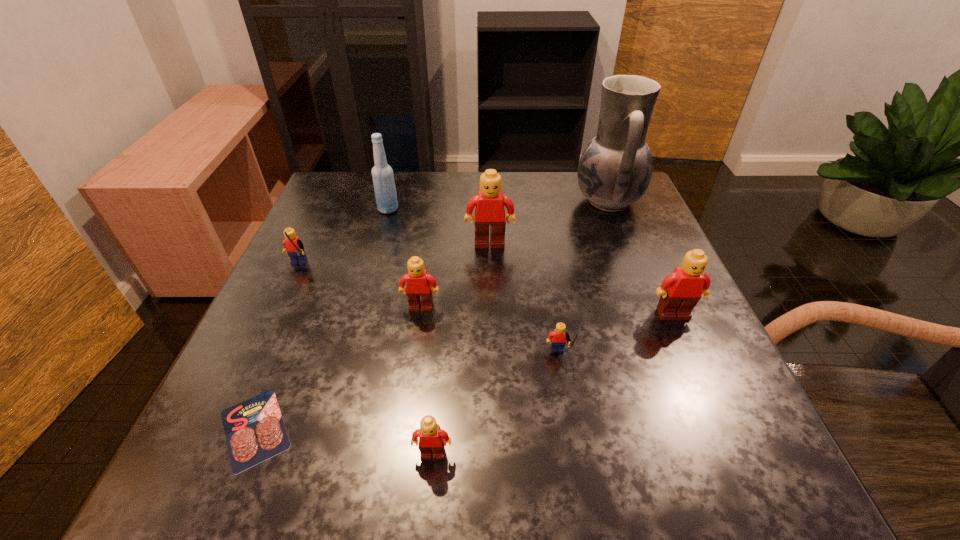
In the image, there is a desktop. Where is `vacant space at the near left corner`? This screenshot has width=960, height=540. vacant space at the near left corner is located at coordinates (181, 492).

Find the location of a particular element. vacant area at the far right corner is located at coordinates (634, 209).

Image resolution: width=960 pixels, height=540 pixels. Identify the location of vacant space that is in between the bottle and the second Lego from right to left. (473, 284).

The width and height of the screenshot is (960, 540). I want to click on vacant space in between the salami and the third biggest brown Lego, so click(338, 368).

Where is `free spot between the smaller yellow Lego and the pitcher`? The width and height of the screenshot is (960, 540). free spot between the smaller yellow Lego and the pitcher is located at coordinates (583, 279).

This screenshot has width=960, height=540. Identify the location of free space between the second smallest brown Lego and the second nearest Lego. (490, 333).

Identify the location of blank region between the tallest object and the salami. (431, 315).

The width and height of the screenshot is (960, 540). I want to click on free point between the third biggest brown Lego and the salami, so click(338, 368).

You are a GUI agent. You are given a task and a screenshot of the screen. Output one action in this format:
    pyautogui.click(x=<x>, y=<y>)
    Task: Click on the free point between the salami and the third farthest object
    This screenshot has width=960, height=540.
    Given the screenshot: What is the action you would take?
    pyautogui.click(x=372, y=336)

This screenshot has height=540, width=960. Find the location of `free space that is in between the second farthest Lego and the third biggest brown Lego`. free space that is in between the second farthest Lego and the third biggest brown Lego is located at coordinates (359, 288).